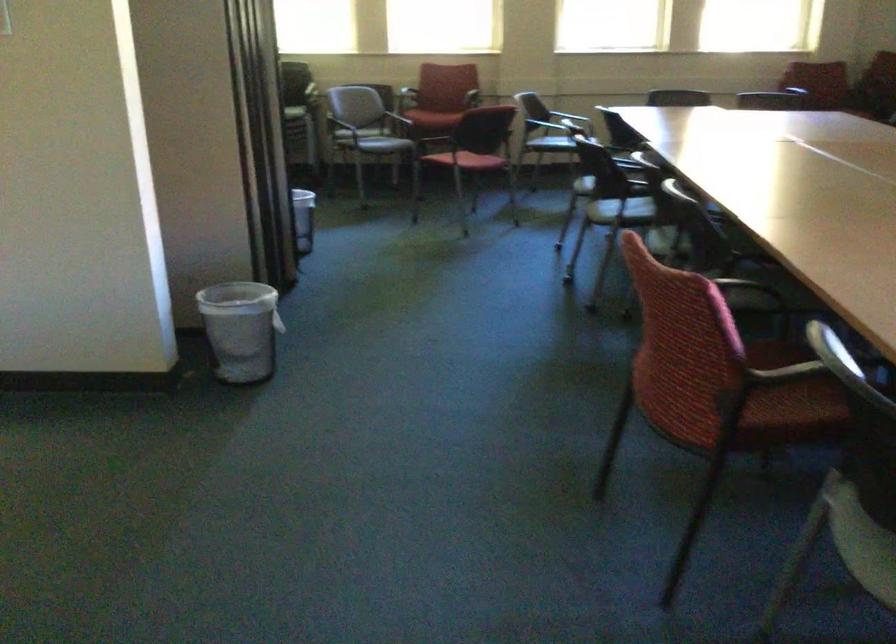
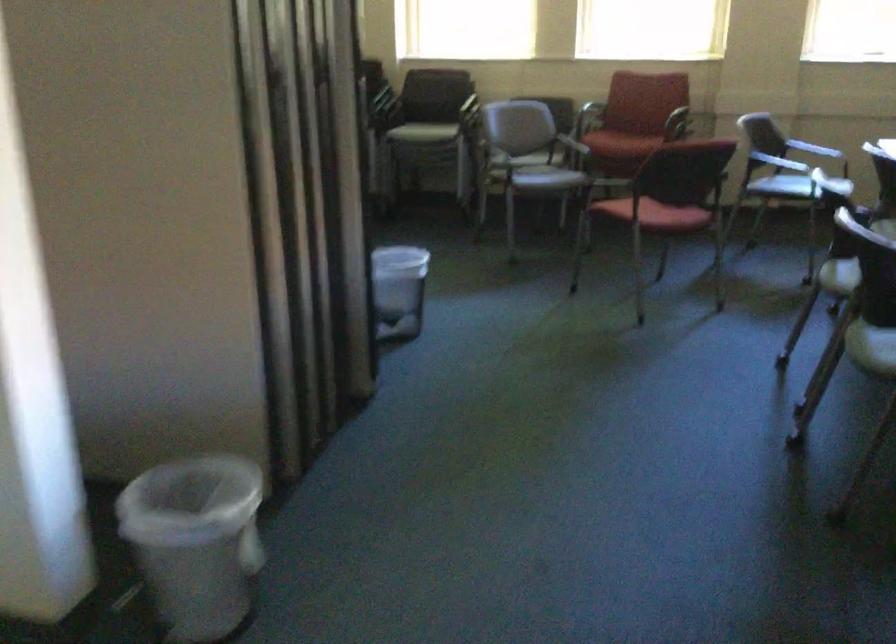
Find the pixel in the second image that matches (561,145) in the first image.

(781, 185)